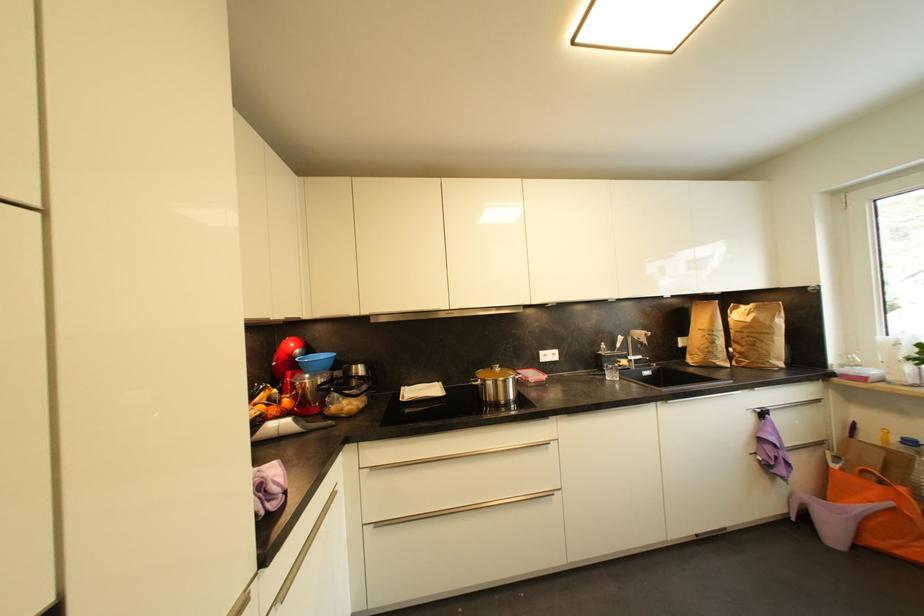
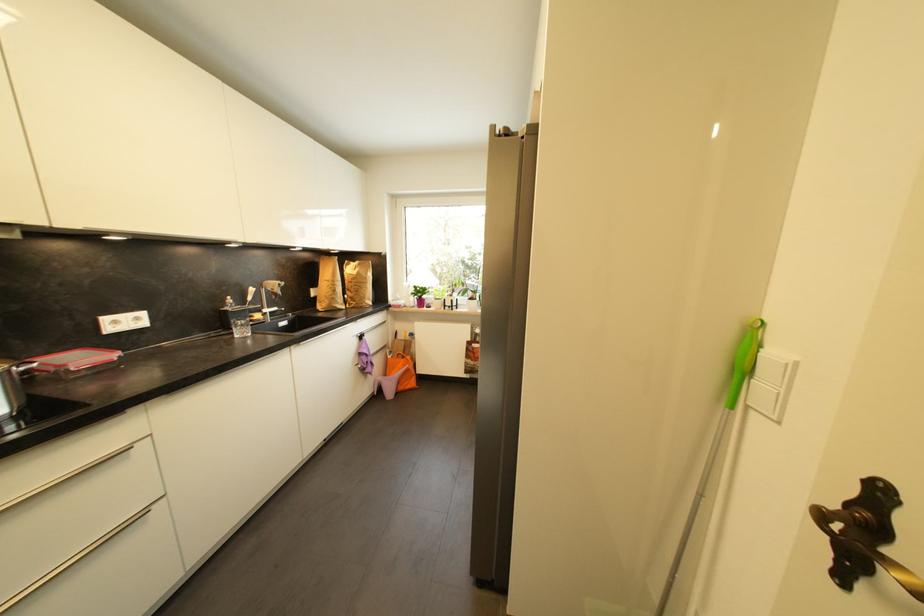
Question: How did the camera likely rotate?

Choices:
 (A) Left
 (B) Right
 (C) Up
 (D) Down

Answer: (B)